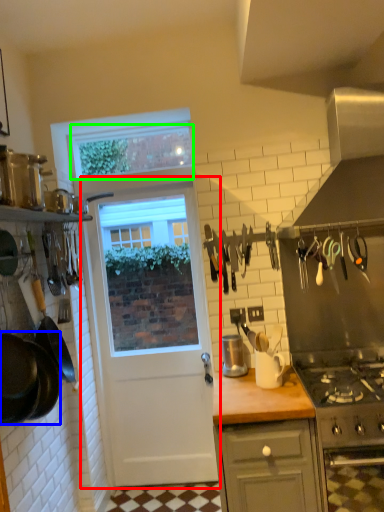
Question: Based on their relative distances, which object is farther from door (highlighted by a red box)? Choose from frying pan (highlighted by a blue box) and window screen (highlighted by a green box).

Choices:
 (A) frying pan
 (B) window screen

Answer: (A)